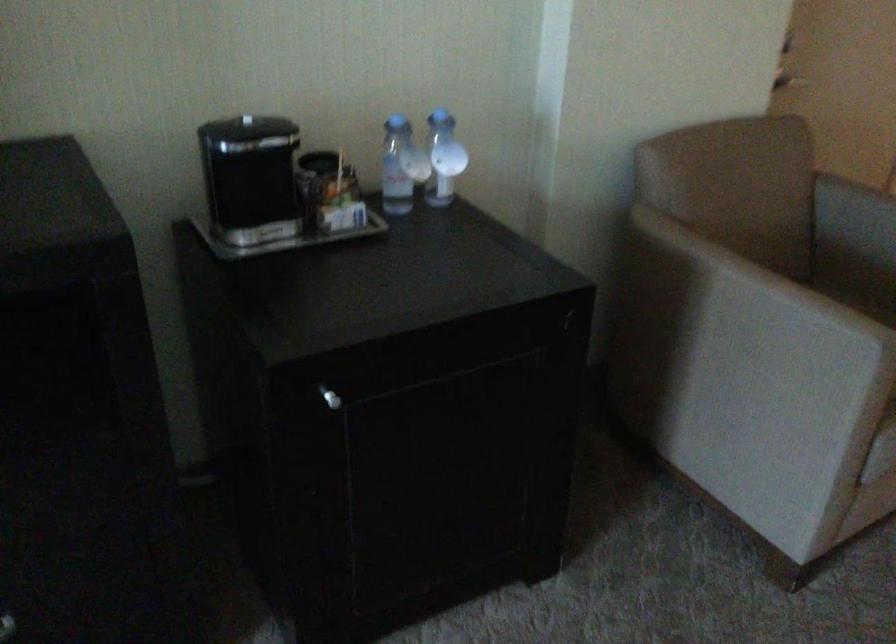
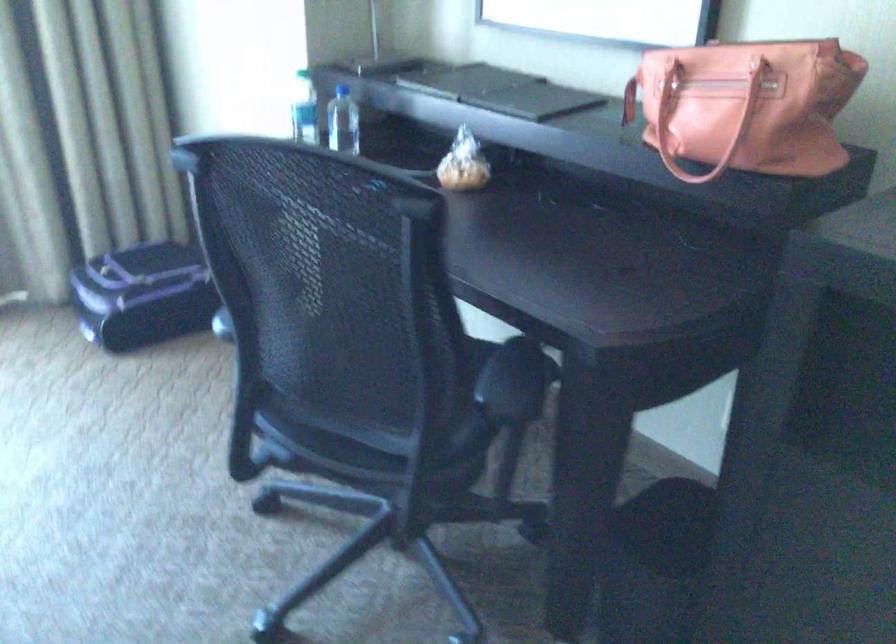
First-person continuous shooting, in which direction is the camera rotating?

The camera's rotation is toward left-down.